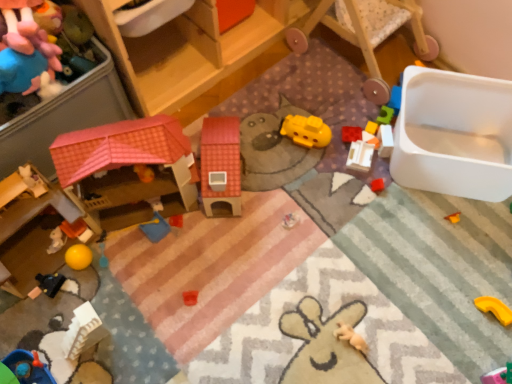
Locate an element on the screen. This screenshot has width=512, height=384. free spot to the right of black matte toy car at lower left, the tenth toy viewed from the right is located at coordinates (112, 284).